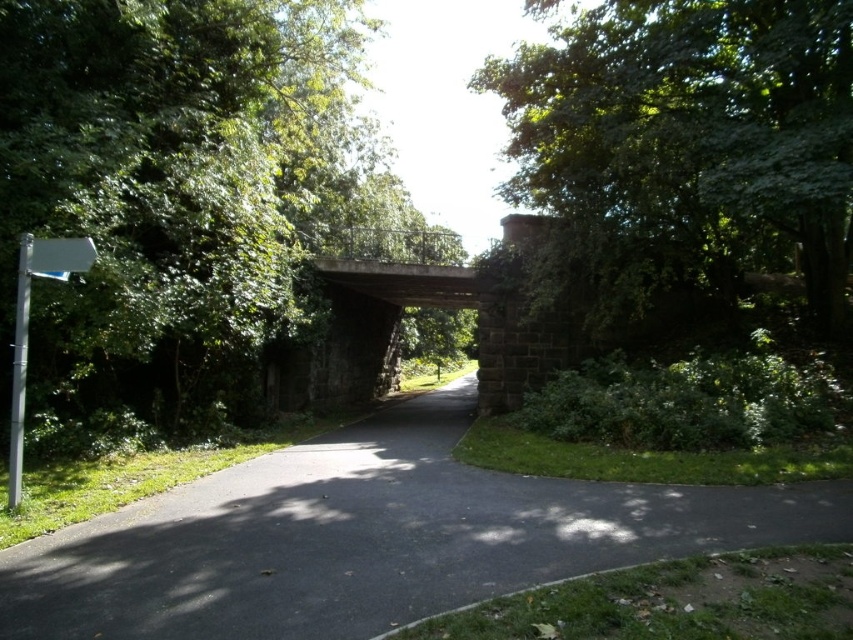
You are a landscape architect planning to install a bench along the pathway. The bench requires a minimum of 5 meters of clear space in front of it to ensure safety. If you place the bench at the asphalt at center, will there be enough space between it and the green leafy tree at upper right?

The distance between the asphalt at center and the green leafy tree at upper right is 8.03 meters, which is more than the required 5 meters. Therefore, placing the bench at the asphalt at center will provide sufficient space.

You are standing on the pathway and want to read the white plastic sign at left. Is the green leafy tree at upper left blocking your view of the sign?

The green leafy tree at upper left is wider than the white plastic sign at left, so it might block the view of the sign depending on their positions.